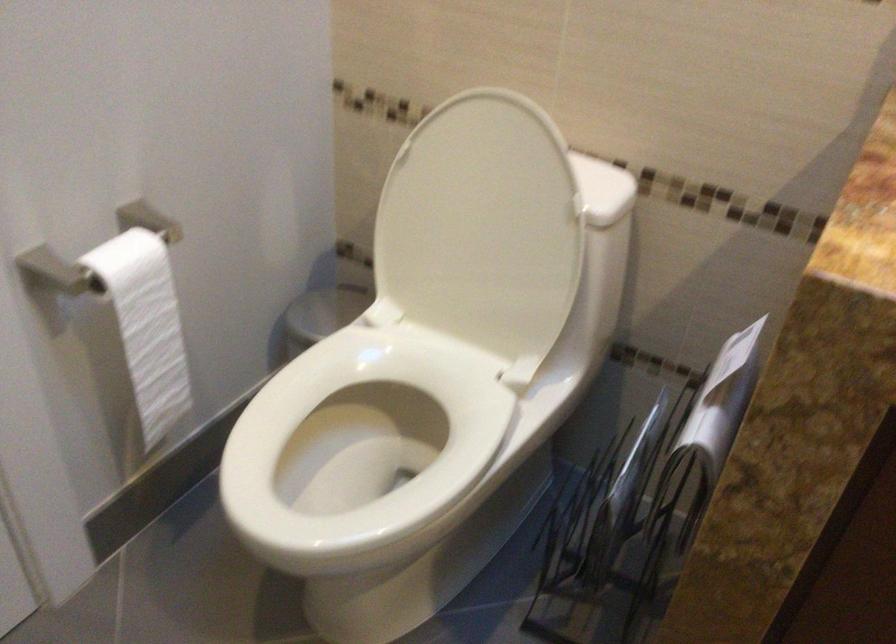
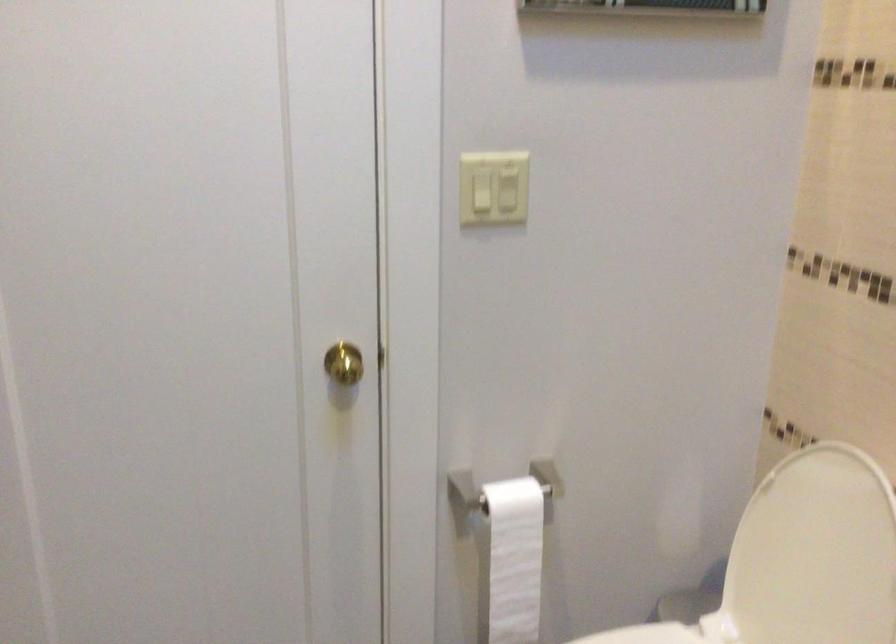
Locate, in the second image, the point that corresponds to (x=150, y=335) in the first image.

(513, 560)